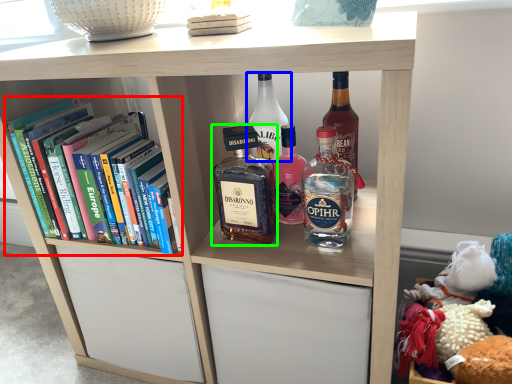
Question: Estimate the real-world distances between objects in this image. Which object is closer to book (highlighted by a red box), bottle (highlighted by a blue box) or bottle (highlighted by a green box)?

Choices:
 (A) bottle
 (B) bottle

Answer: (B)